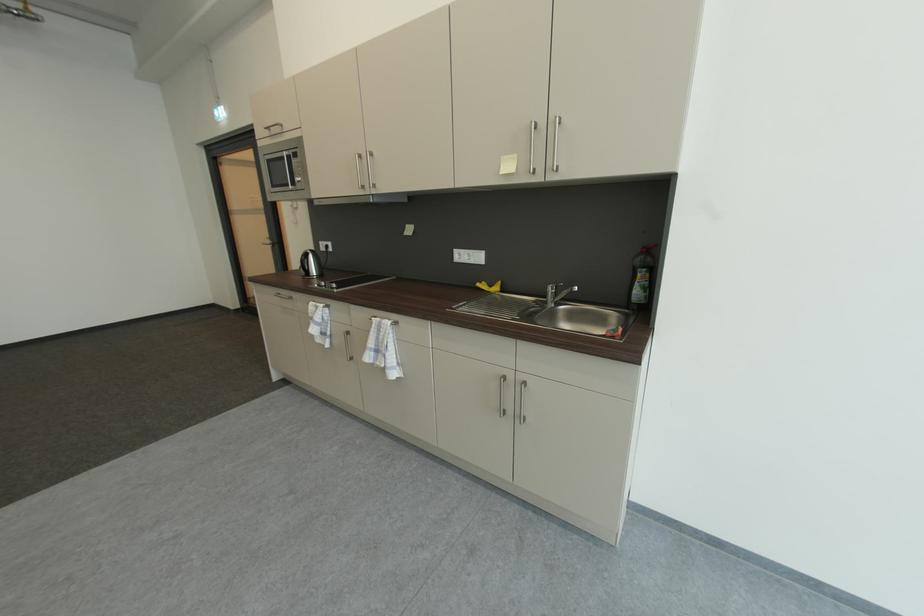
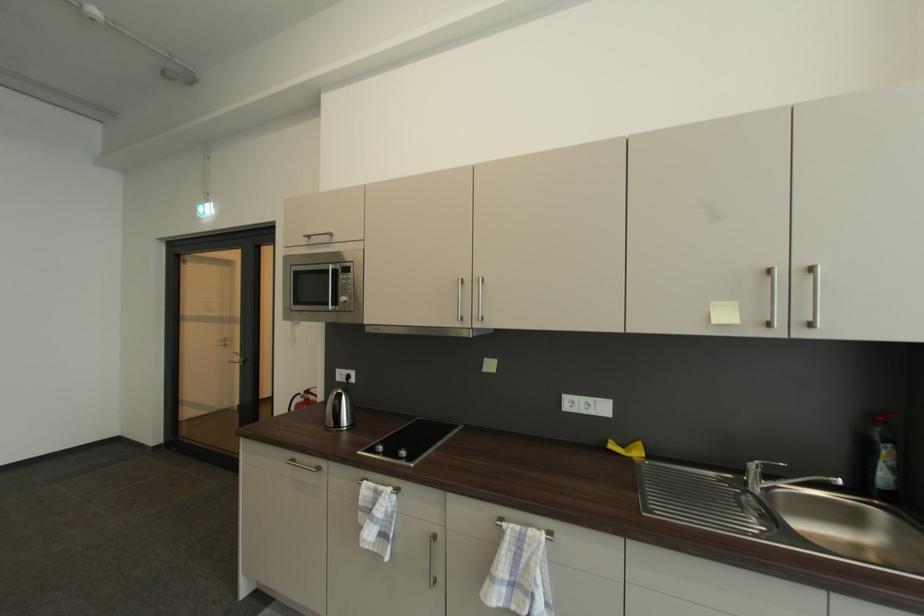
In the second image, find the point that corresponds to pixel 487 284 in the first image.

(613, 443)